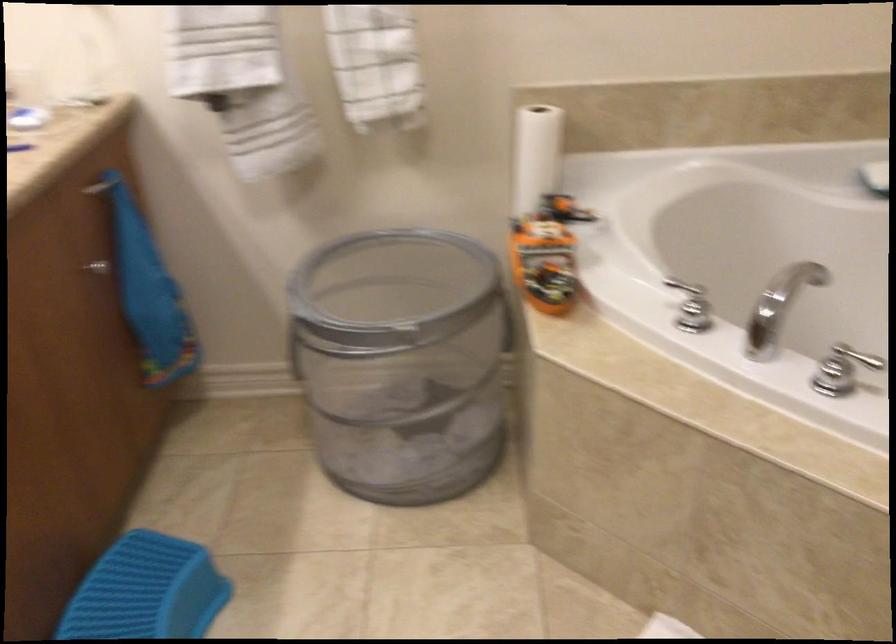
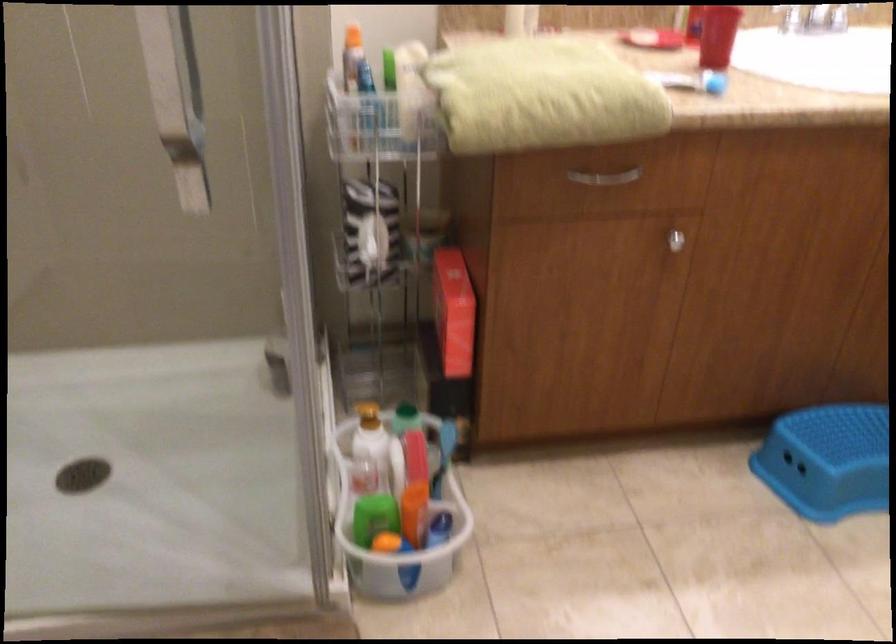
The images are taken continuously from a first-person perspective. In which direction is your viewpoint rotating?

The camera rotated toward left-down.